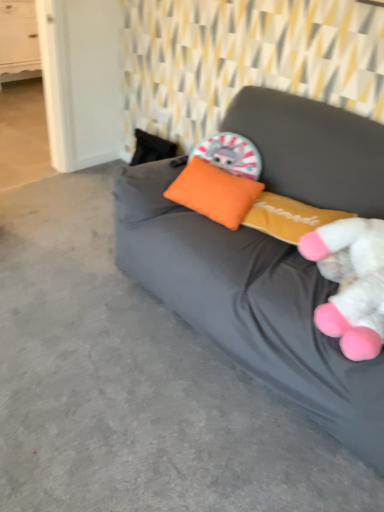
Question: Is white plush toy at right aimed at matte gray bean bag at center?

Choices:
 (A) no
 (B) yes

Answer: (B)

Question: Does white plush toy at right come in front of matte gray bean bag at center?

Choices:
 (A) no
 (B) yes

Answer: (A)

Question: Are white plush toy at right and matte gray bean bag at center beside each other?

Choices:
 (A) yes
 (B) no

Answer: (B)

Question: From the image's perspective, does white plush toy at right appear lower than matte gray bean bag at center?

Choices:
 (A) no
 (B) yes

Answer: (B)

Question: Is matte gray bean bag at center surrounded by white plush toy at right?

Choices:
 (A) no
 (B) yes

Answer: (A)

Question: Is matte gray bean bag at center bigger or smaller than white plush toy at right?

Choices:
 (A) big
 (B) small

Answer: (A)

Question: Choose the correct answer: Is matte gray bean bag at center inside white plush toy at right or outside it?

Choices:
 (A) inside
 (B) outside

Answer: (B)

Question: From a real-world perspective, relative to white plush toy at right, is matte gray bean bag at center vertically above or below?

Choices:
 (A) above
 (B) below

Answer: (B)

Question: In terms of width, does matte gray bean bag at center look wider or thinner when compared to white plush toy at right?

Choices:
 (A) wide
 (B) thin

Answer: (A)

Question: Relative to white plush toy at right, is orange fabric pillow at center in front or behind?

Choices:
 (A) behind
 (B) front

Answer: (A)

Question: In terms of height, does orange fabric pillow at center look taller or shorter compared to white plush toy at right?

Choices:
 (A) tall
 (B) short

Answer: (B)

Question: Is orange fabric pillow at center inside or outside of white plush toy at right?

Choices:
 (A) outside
 (B) inside

Answer: (A)

Question: Does point (175, 188) appear closer or farther from the camera than point (324, 256)?

Choices:
 (A) farther
 (B) closer

Answer: (A)

Question: In the image, is matte gray bean bag at center positioned in front of or behind white wood drawer at upper left?

Choices:
 (A) front
 (B) behind

Answer: (A)

Question: Considering the positions of matte gray bean bag at center and white wood drawer at upper left in the image, is matte gray bean bag at center bigger or smaller than white wood drawer at upper left?

Choices:
 (A) big
 (B) small

Answer: (A)